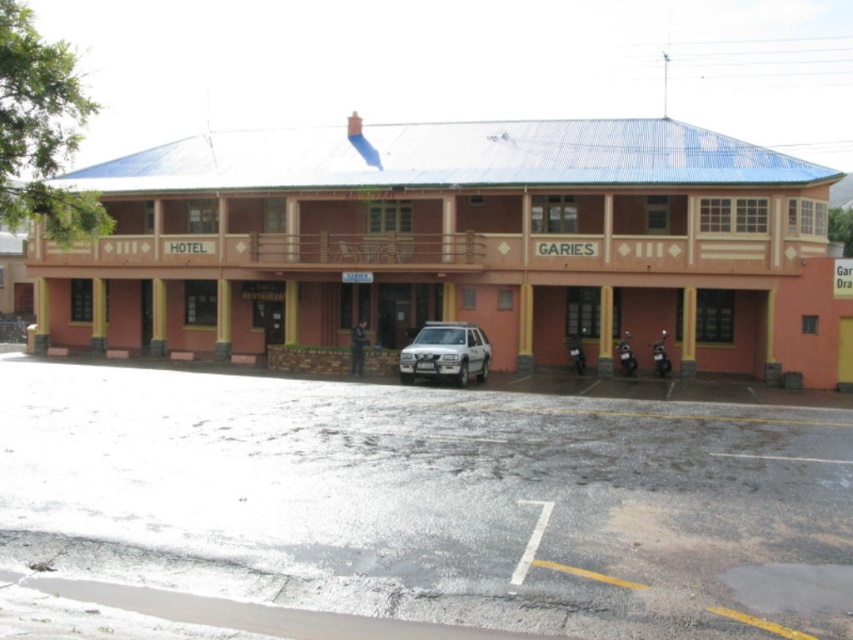
You are a delivery person who needs to park your 1.8 meters tall delivery box in the parking lot. The parking lot has a white matte suv at center and a metallic silver motorcycle at center. Which vehicle is taller so that you can place the box on top of it?

The white matte suv at center is taller than the metallic silver motorcycle at center, so you can place the delivery box on top of the white matte suv at center.

Consider the image. You are standing in front of the two story building and want to park your car. You see a white matte suv at center and a metallic silver motorcycle at center. Which vehicle is closer to you?

The white matte suv at center is closer to you than the metallic silver motorcycle at center.

You need to park your car in the gray asphalt parking lot at center. There is a black matte motorcycle at lower right already parked. Will your car fit in the parking lot without overlapping the motorcycle?

The gray asphalt parking lot at center is larger in size than the black matte motorcycle at lower right, so your car should fit without overlapping the motorcycle.